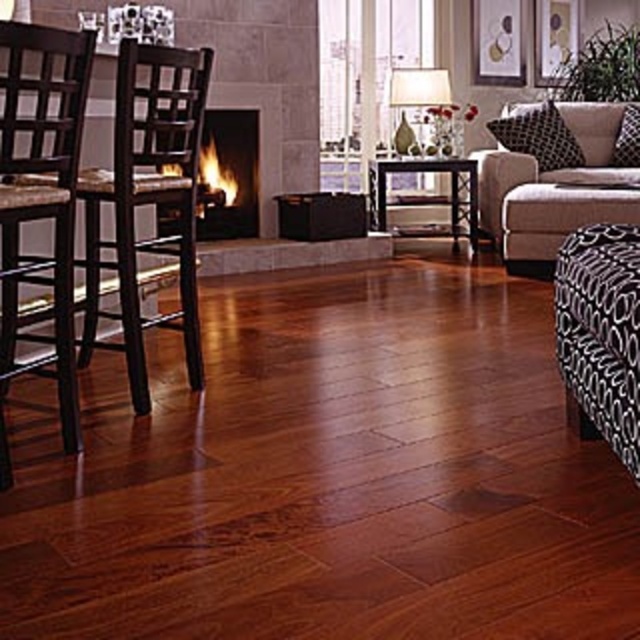
You are arranging flowers in the living room and need to place a vase between the black printed cushion at upper right and the white fabric lampshade at upper center. Based on their positions, which object should the vase be closer to?

The vase should be placed closer to the white fabric lampshade at upper center since the black printed cushion at upper right is positioned to the right of the white fabric lampshade at upper center, meaning the lampshade is to the left of the cushion. Therefore, placing the vase between them would require it to be closer to the lampshade to maintain the leftward direction.

You are a guest in this living room and want to sit down. Which object would you choose between the beige fabric couch at right and the white fabric lampshade at upper center, and why?

You would choose the beige fabric couch at right because it is bigger and designed for sitting, while the white fabric lampshade at upper center is part of a lamp and not meant for seating.

You are standing in the living room and looking at two points marked on the floor. The first point is at coordinates point (568, 164) and the second is at point (400, 86). Which point is closer to you?

Point (568, 164) is further to the camera than point (400, 86), so the closer point to you is point (400, 86).